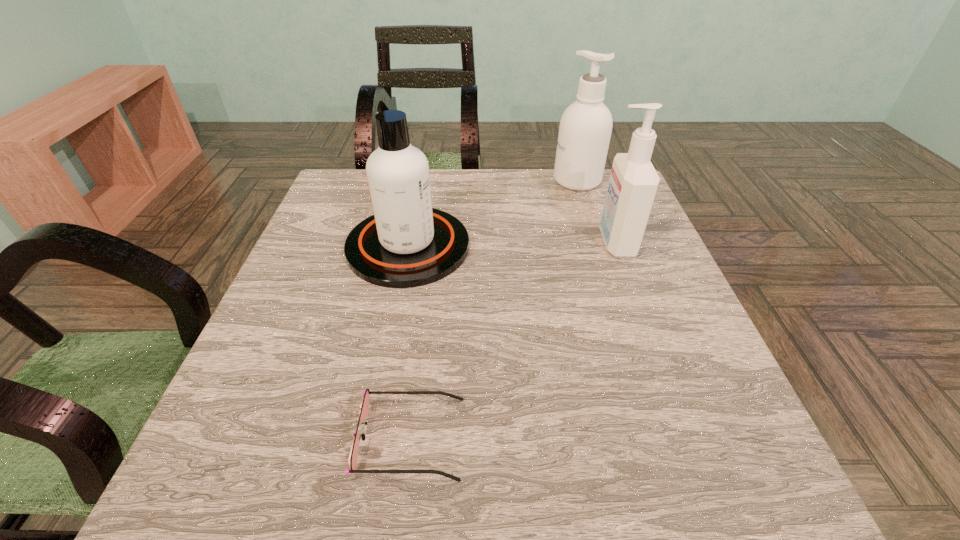
You are a GUI agent. You are given a task and a screenshot of the screen. Output one action in this format:
    pyautogui.click(x=<x>, y=<y>)
    Task: Click on the object that is positioned at the left edge
    This screenshot has width=960, height=540.
    Given the screenshot: What is the action you would take?
    pyautogui.click(x=406, y=243)

This screenshot has height=540, width=960. I want to click on object positioned at the far left corner, so click(x=406, y=243).

You are a GUI agent. You are given a task and a screenshot of the screen. Output one action in this format:
    pyautogui.click(x=<x>, y=<y>)
    Task: Click on the object located at the far right corner
    
    Given the screenshot: What is the action you would take?
    pyautogui.click(x=585, y=128)

This screenshot has height=540, width=960. Find the location of `vacant space at the far edge of the desktop`. vacant space at the far edge of the desktop is located at coordinates (467, 189).

At what (x,y) coordinates should I click in order to perform the action: click on vacant space at the near edge. Please return your answer as a coordinate pair (x, y). The image size is (960, 540). Looking at the image, I should click on (502, 467).

In the image, there is a desktop. At what (x,y) coordinates should I click in order to perform the action: click on vacant space at the left edge. Please return your answer as a coordinate pair (x, y). Image resolution: width=960 pixels, height=540 pixels. Looking at the image, I should click on (279, 426).

You are a GUI agent. You are given a task and a screenshot of the screen. Output one action in this format:
    pyautogui.click(x=<x>, y=<y>)
    Task: Click on the free space at the right edge of the desktop
    
    Given the screenshot: What is the action you would take?
    pyautogui.click(x=706, y=347)

The height and width of the screenshot is (540, 960). What are the coordinates of `vacant space at the far left corner of the desktop` in the screenshot? It's located at (338, 195).

The width and height of the screenshot is (960, 540). Identify the location of vacant space at the near left corner of the desktop. (271, 476).

Image resolution: width=960 pixels, height=540 pixels. I want to click on vacant space at the far right corner of the desktop, so click(586, 194).